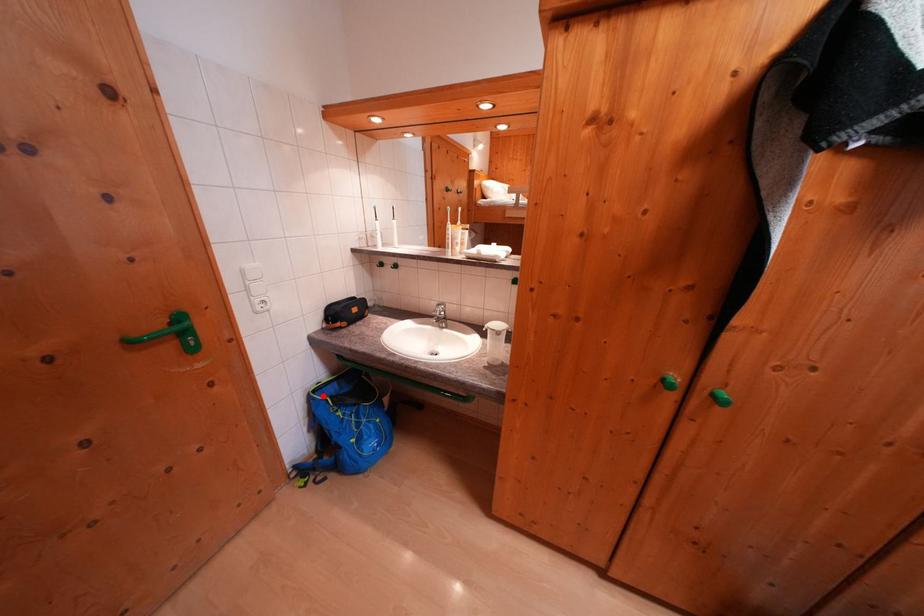
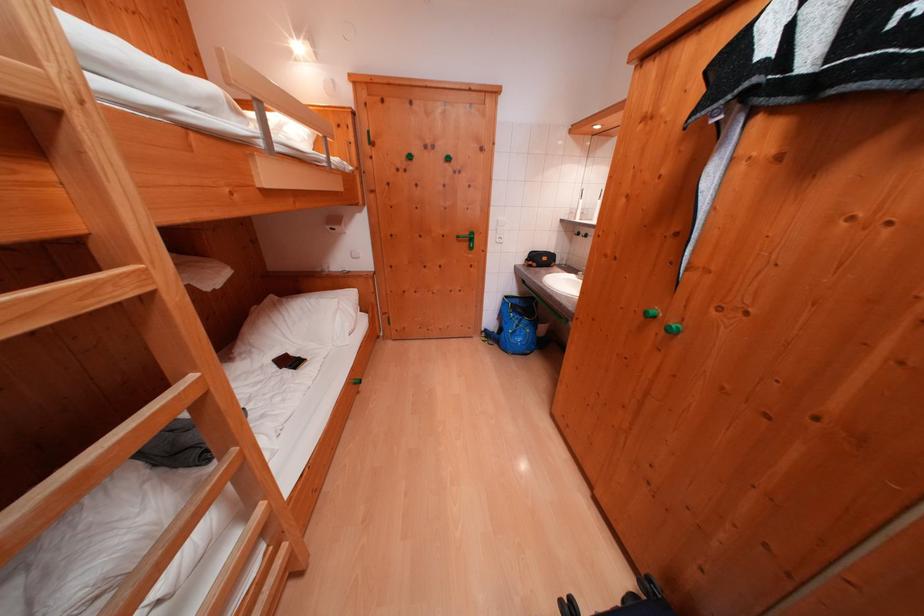
Locate, in the second image, the point that corresponds to the highlighted location in the first image.

(515, 301)